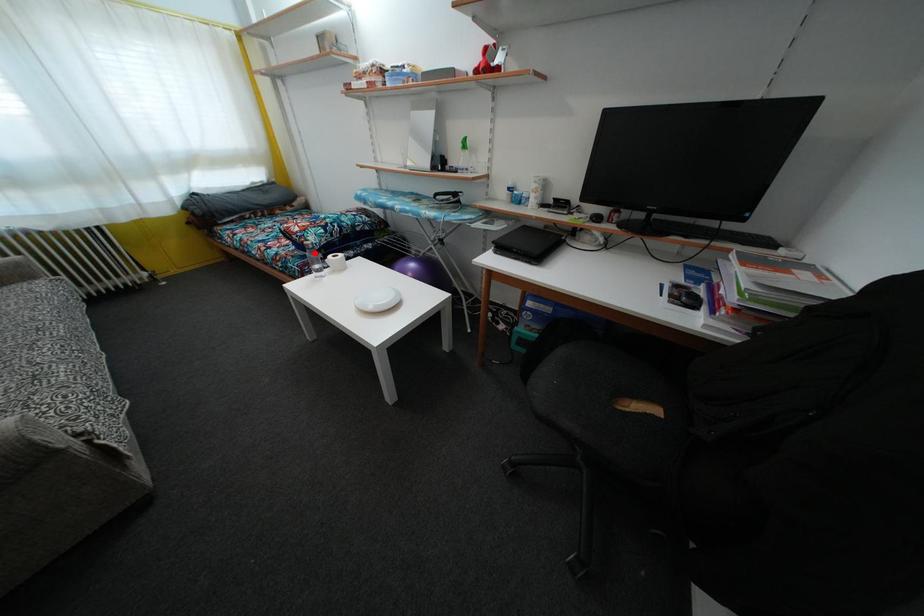
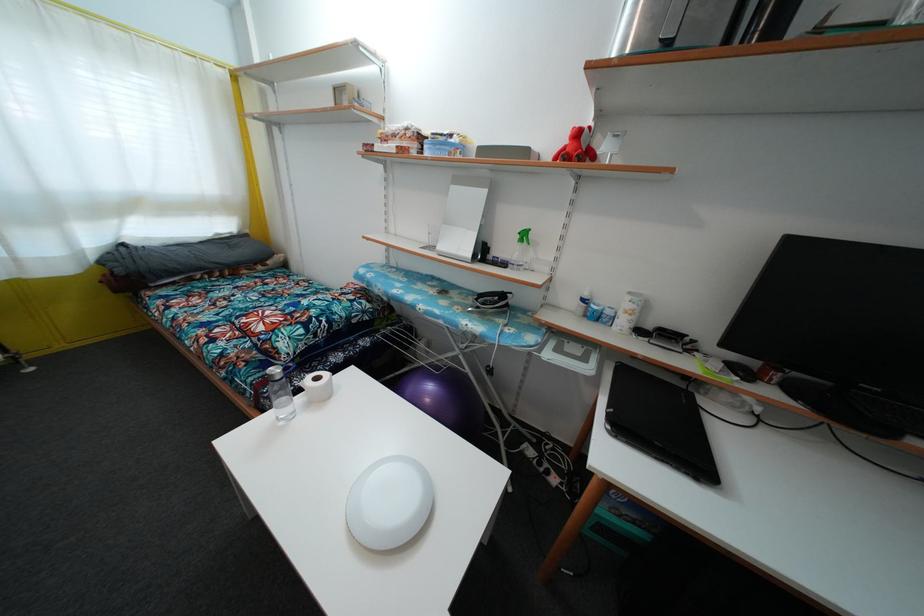
Question: I am providing you with two images of the same scene from different viewpoints. A red point is shown in image1. For the corresponding object point in image2, is it positioned nearer or farther from the camera?

Choices:
 (A) Nearer
 (B) Farther

Answer: (A)